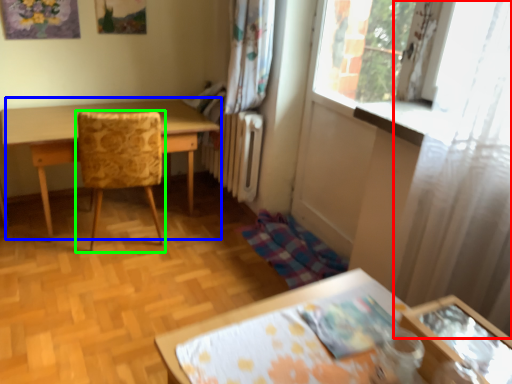
Question: Estimate the real-world distances between objects in this image. Which object is farther from curtain (highlighted by a red box), table (highlighted by a blue box) or chair (highlighted by a green box)?

Choices:
 (A) table
 (B) chair

Answer: (A)